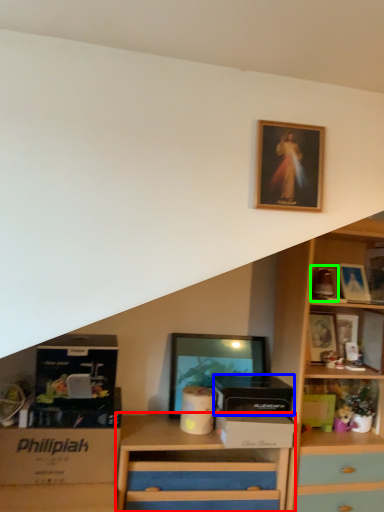
Question: Which object is the closest to the chest of drawers (highlighted by a red box)? Choose among these: box (highlighted by a blue box) or picture frame (highlighted by a green box).

Choices:
 (A) box
 (B) picture frame

Answer: (A)